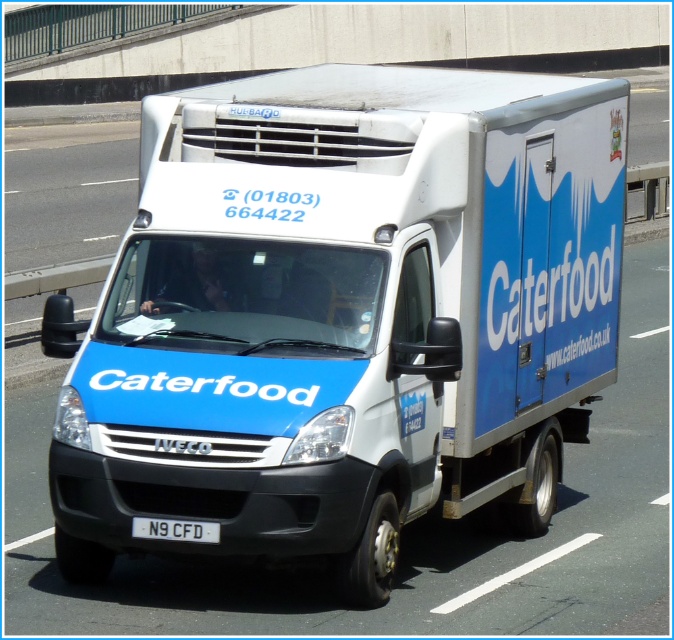
Between point (417, 259) and point (179, 536), which one is positioned in front?

Point (179, 536)

Between blue matte truck at center and white plastic license plate at center, which one is positioned lower?

white plastic license plate at center

Between point (574, 296) and point (137, 524), which one is positioned in front?

Point (137, 524)

The height and width of the screenshot is (640, 674). What are the coordinates of `blue matte truck at center` in the screenshot? It's located at (342, 316).